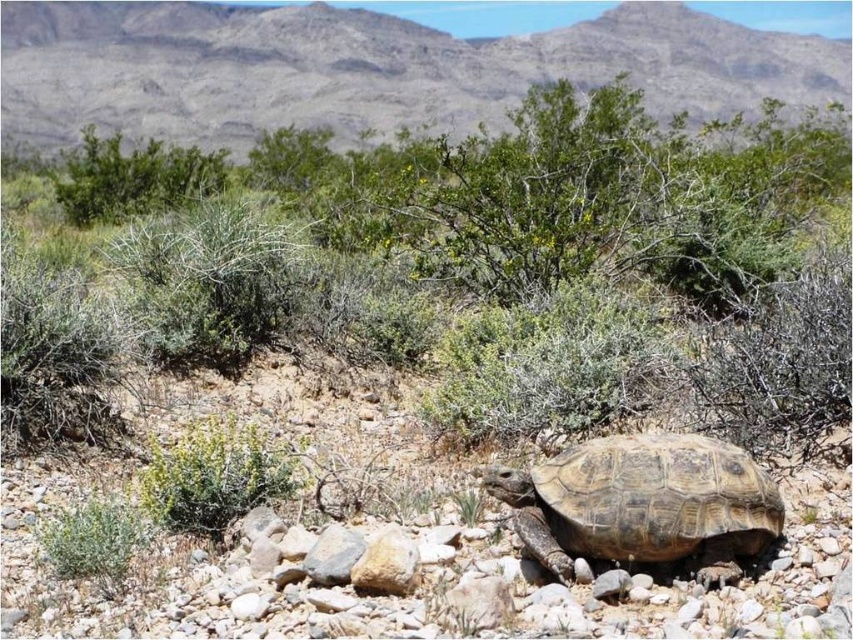
In the scene shown: You are navigating through a desert and see two points marked on your map. The first point is at coordinates point (637, 273) and the second is at point (222, 445). Which point is closer to your current position if you are standing at the origin?

Point (222, 445) is closer to the origin than point (637, 273) because it has a shorter distance when calculated using the Pythagorean theorem.

You are a desert explorer who needs to locate the green leafy bush at center. From your current position, which direction should you move to reach it relative to the brown textured tortoise at center?

The brown textured tortoise at center is in front of the green leafy bush at center, so the bush is behind the tortoise. To reach the green leafy bush at center, you should move behind the brown textured tortoise at center.